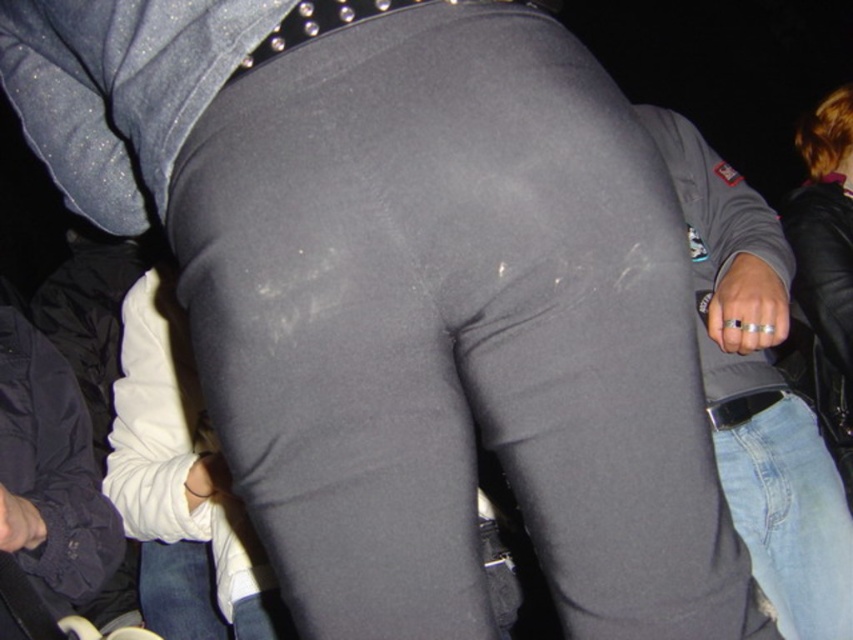
Consider the image. You are a photographer trying to adjust the lighting for a photo shoot. The scene includes a leather jacket at upper right and jeans at lower left. Since the lighting is uneven, you want to ensure both items are properly illuminated. Which object should you focus the light on first to account for their size difference?

The leather jacket at upper right is larger in size than the jeans at lower left, so you should focus the light on the leather jacket at upper right first to ensure it is properly illuminated given its larger surface area.

You are a photographer trying to adjust the lighting for a photo shoot. You notice the leather jacket at upper right and the jeans at lower left in the frame. Which object should you move closer to the light source to ensure both are well lit?

The leather jacket at upper right is to the right of jeans at lower left. To ensure both are well lit, move the jeans at lower left closer to the light source since it is positioned further away from the light compared to the leather jacket at upper right.

You are trying to locate the denim jeans at right in a crowded night scene. Based on the coordinates provided, where exactly would you find them?

The denim jeans at right are precisely located at the coordinates point (x=759, y=388).